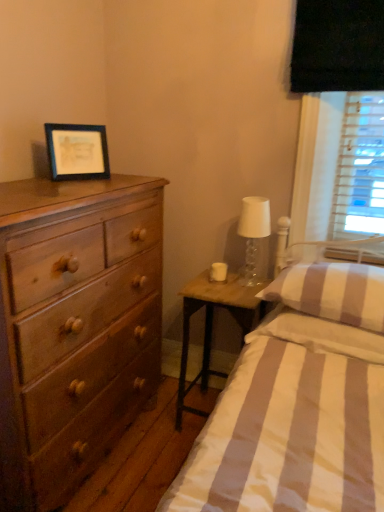
Where is `vacant space situated on the left part of translucent glass lampshade at right`? The width and height of the screenshot is (384, 512). vacant space situated on the left part of translucent glass lampshade at right is located at coordinates (217, 284).